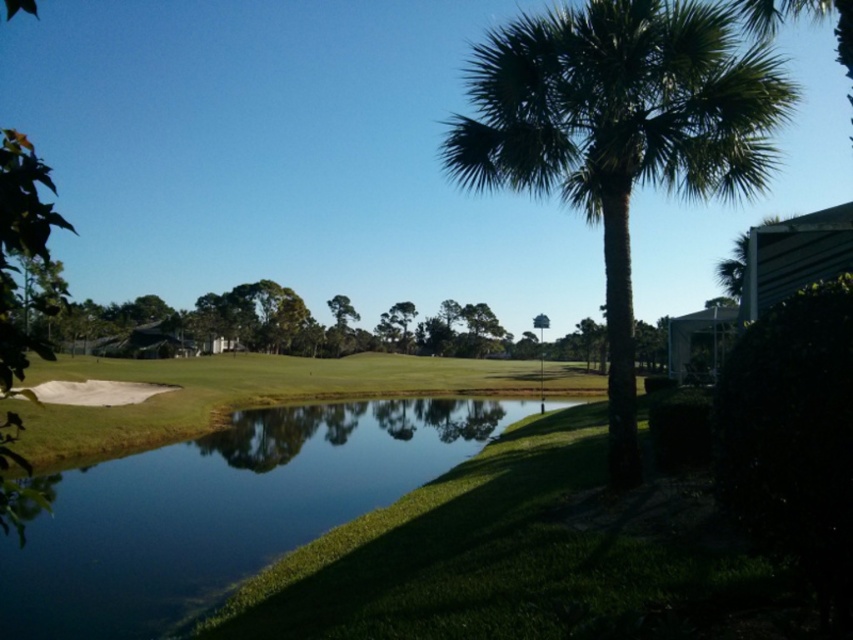
Question: Which point is farther to the camera?

Choices:
 (A) (519, 410)
 (B) (732, 83)

Answer: (A)

Question: Where is clear water at pond center located in relation to green leafy palm tree at right in the image?

Choices:
 (A) right
 (B) left

Answer: (B)

Question: Which point is closer to the camera?

Choices:
 (A) (247, 493)
 (B) (491, 100)

Answer: (B)

Question: Can you confirm if clear water at pond center is smaller than green leafy palm tree at right?

Choices:
 (A) no
 (B) yes

Answer: (B)

Question: Can you confirm if clear water at pond center is smaller than green leafy palm tree at right?

Choices:
 (A) yes
 (B) no

Answer: (A)

Question: Which of the following is the closest to the observer?

Choices:
 (A) (517, 157)
 (B) (316, 429)

Answer: (A)